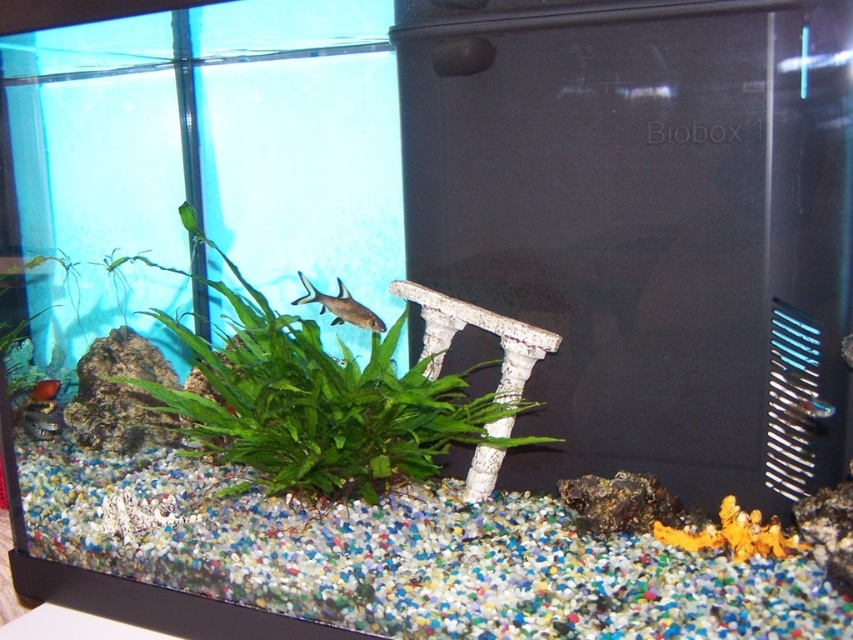
Question: Can you confirm if green leafy plant at center is wider than green leafy plant at upper left?

Choices:
 (A) no
 (B) yes

Answer: (B)

Question: Which is nearer to the matte black fish at lower left?

Choices:
 (A) shiny silver fish at center
 (B) translucent glass fish at center
 (C) green leafy plant at upper left
 (D) green leafy plant at center

Answer: (C)

Question: Can you confirm if green leafy plant at center is positioned to the left of translucent glass fish at center?

Choices:
 (A) no
 (B) yes

Answer: (B)

Question: Which point is closer to the camera?

Choices:
 (A) translucent glass fish at center
 (B) green leafy plant at upper left
 (C) green leafy plant at center
 (D) shiny silver fish at center

Answer: (A)

Question: Which object is closer to the camera taking this photo?

Choices:
 (A) green leafy plant at center
 (B) green leafy plant at upper left

Answer: (A)

Question: In this image, where is green leafy plant at center located relative to translucent glass fish at center?

Choices:
 (A) above
 (B) below

Answer: (A)